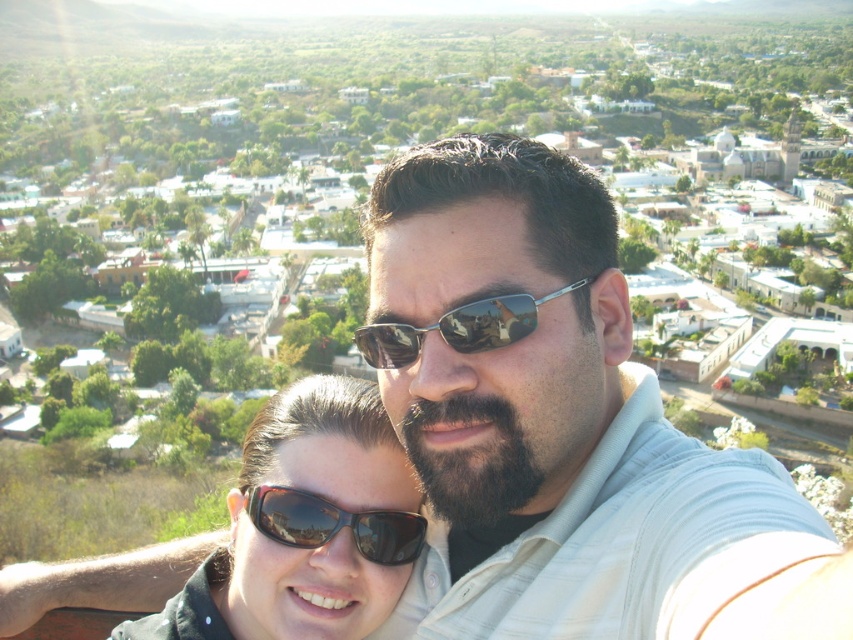
You are a photographer trying to capture a closeup of the two people in the foreground. You notice both the black reflective sunglasses at center and the metallic reflective sunglasses at center. Which pair of sunglasses has a wider frame?

The metallic reflective sunglasses at center has a wider frame than the black reflective sunglasses at center, as the black reflective sunglasses at center is narrower in width.